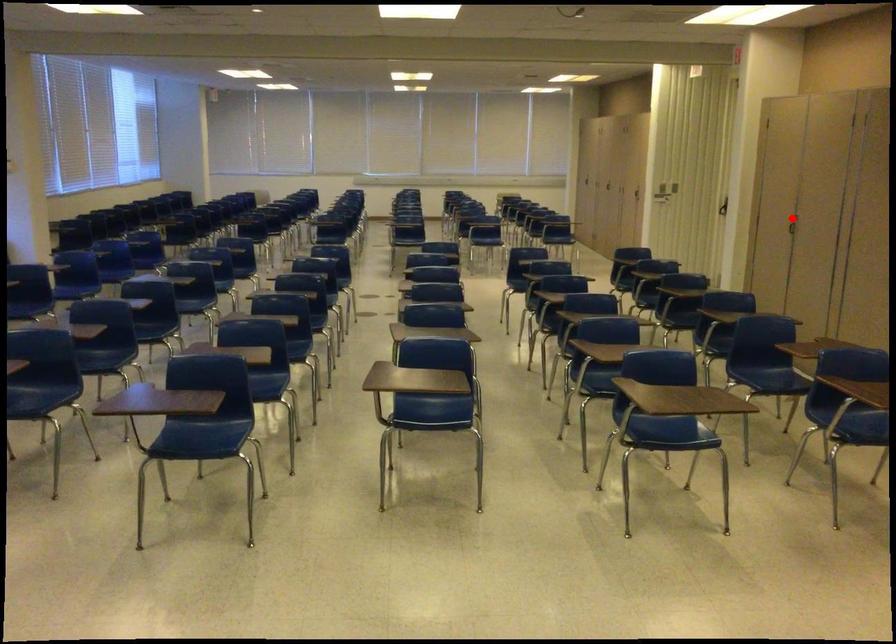
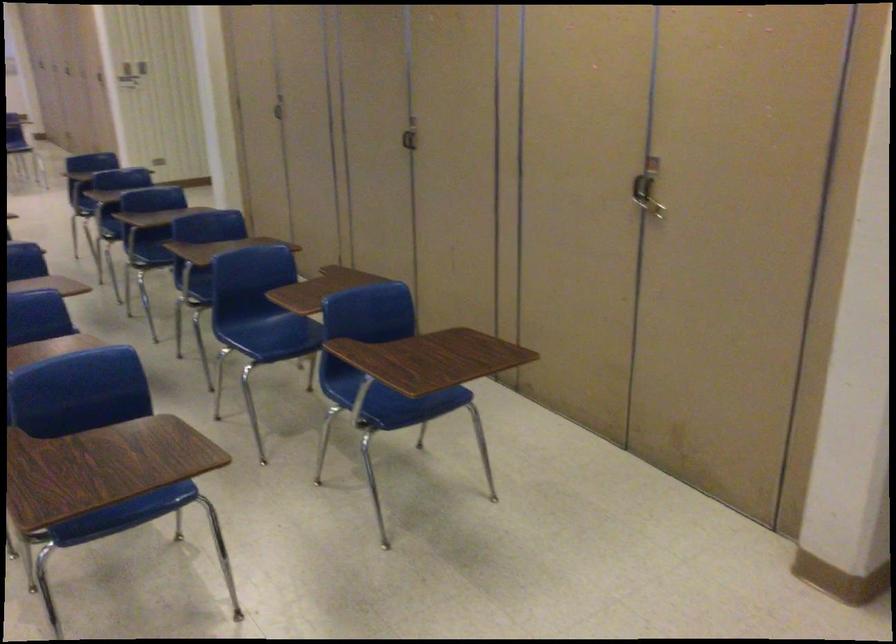
Question: I am providing you with two images of the same scene from different viewpoints. Given a red point in image1, look at the same physical point in image2. Is it:

Choices:
 (A) Closer to the viewpoint
 (B) Farther from the viewpoint

Answer: (A)